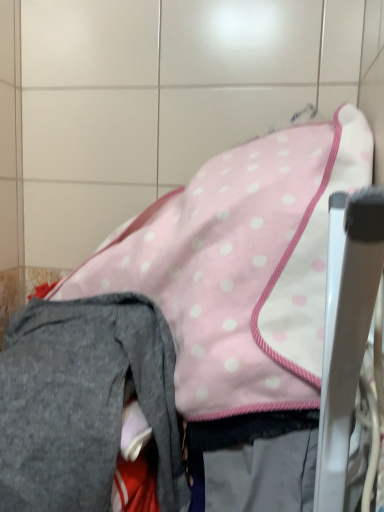
Question: Is gray fleece pants at lower left spatially inside metallic silver chair at right, or outside of it?

Choices:
 (A) inside
 (B) outside

Answer: (B)

Question: From the image's perspective, is gray fleece pants at lower left above or below metallic silver chair at right?

Choices:
 (A) above
 (B) below

Answer: (B)

Question: Based on their relative distances, which object is nearer to the pink polka dot fabric at center?

Choices:
 (A) gray fleece pants at lower left
 (B) metallic silver chair at right

Answer: (A)

Question: Which is farther from the metallic silver chair at right?

Choices:
 (A) pink polka dot fabric at center
 (B) gray fleece pants at lower left

Answer: (B)